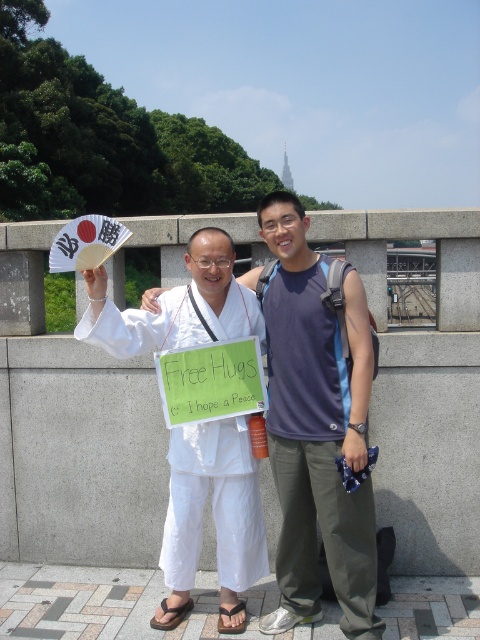
You are a photographer trying to capture a symmetrical shot of both people. Since the white cotton kimono at center and the matte gray tank top at center are positioned in a certain way, which direction should you move to frame them symmetrically?

The white cotton kimono at center is to the left of the matte gray tank top at center, so you should move to the left side to frame them symmetrically.